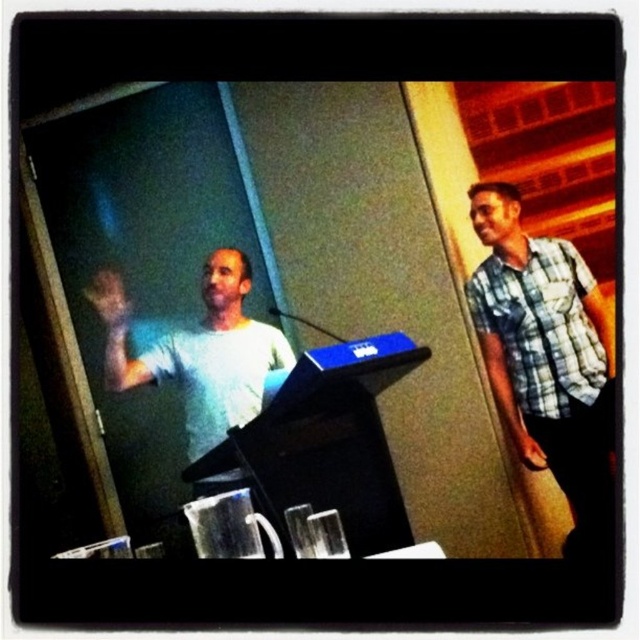
You are attending a presentation and want to locate the person wearing the checkered fabric shirt at right. Based on the coordinates provided, where should you look in the image?

You should look at point (x=545, y=355) in the image to find the checkered fabric shirt at right.

You are standing in the room where the presentation is happening. There are two points marked in the image. The first point is at coordinates point [538,397] and the second is at point [250,272]. Which point is closer to you?

Point [538,397] is closer to the viewer than point [250,272].